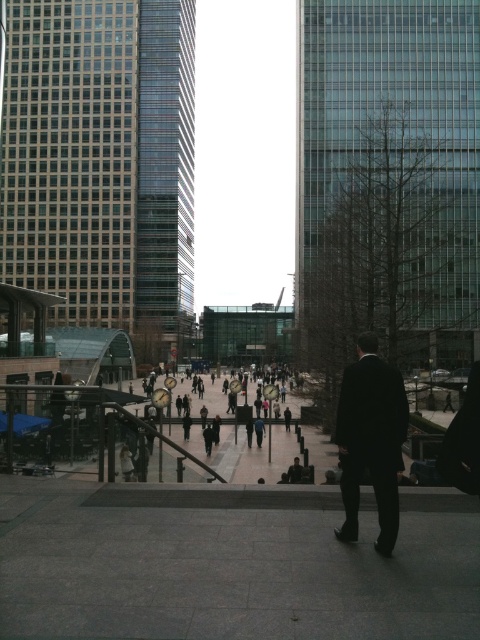
You are standing at the point marked as point [228,570] in the urban scene. What type of surface are you currently standing on?

The point [228,570] is on gray concrete pavement at center, so you are standing on gray concrete pavement.

You are standing on the gray concrete pavement at center and want to reach the black suit at center. Which direction should you move to get closer?

The gray concrete pavement at center is to the left of the black suit at center, so you should move to the right to get closer.

You are a delivery person standing on the gray concrete pavement at center. You need to deliver a package to someone wearing a black suit at center. Which object is closer to you?

The gray concrete pavement at center is closer to you since it is shorter than the black suit at center, meaning the black suit is elevated or positioned higher up.